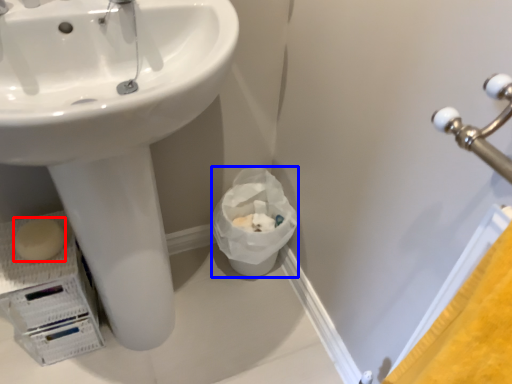
Question: Among these objects, which one is farthest to the camera, soap (highlighted by a red box) or garbage (highlighted by a blue box)?

Choices:
 (A) soap
 (B) garbage

Answer: (B)